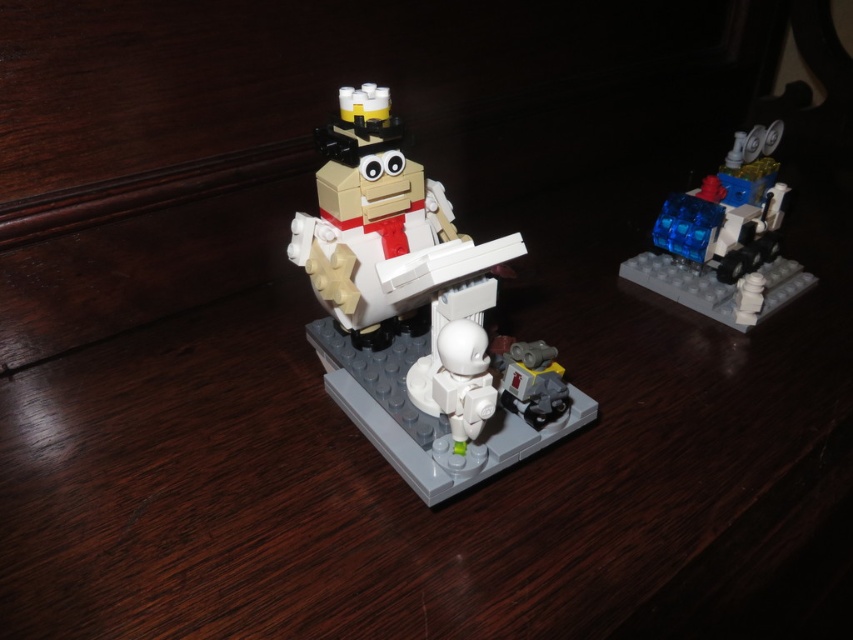
You are an astronaut trying to reach the transparent blue plastic at upper right from the matte plastic astronaut at center. Considering their sizes, will you have to bend down or stand up straight to reach it?

The matte plastic astronaut at center is taller than the transparent blue plastic at upper right, so you would need to bend down to reach the transparent blue plastic at upper right.

You are a LEGO enthusiast trying to assemble a new set. You have the matte plastic astronaut at center and the transparent blue plastic at upper right in front of you. Based on their positions in the image, which object should you place first to follow the correct assembly order?

The matte plastic astronaut at center should be placed first since it is in front of the transparent blue plastic at upper right, indicating it was assembled first.

You are an astronaut in a space station and need to reach the transparent blue plastic at upper right from your current position near the matte plastic astronaut at center. The space station has a 20 inch wide corridor. Can you safely navigate through without any obstacles?

The distance between the matte plastic astronaut at center and the transparent blue plastic at upper right is 21.89 inches. Since the corridor is 20 inches wide, the astronaut would not be able to safely navigate through as the required space is slightly larger than the available corridor width.